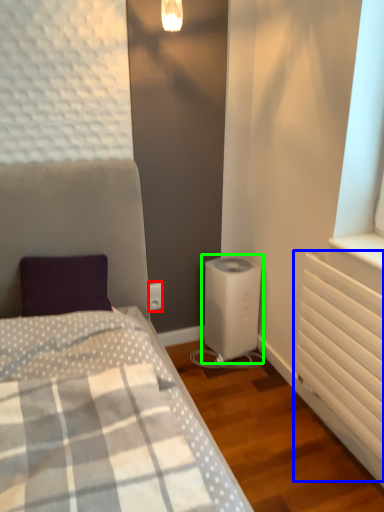
Question: Based on their relative distances, which object is farther from electric outlet (highlighted by a red box)? Choose from radiator (highlighted by a blue box) and water heater (highlighted by a green box).

Choices:
 (A) radiator
 (B) water heater

Answer: (A)